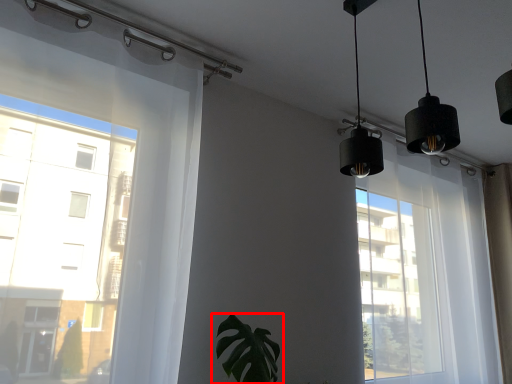
Question: Considering the relative positions of houseplant (annotated by the red box) and bay window in the image provided, where is houseplant (annotated by the red box) located with respect to the staircase?

Choices:
 (A) left
 (B) right

Answer: (A)